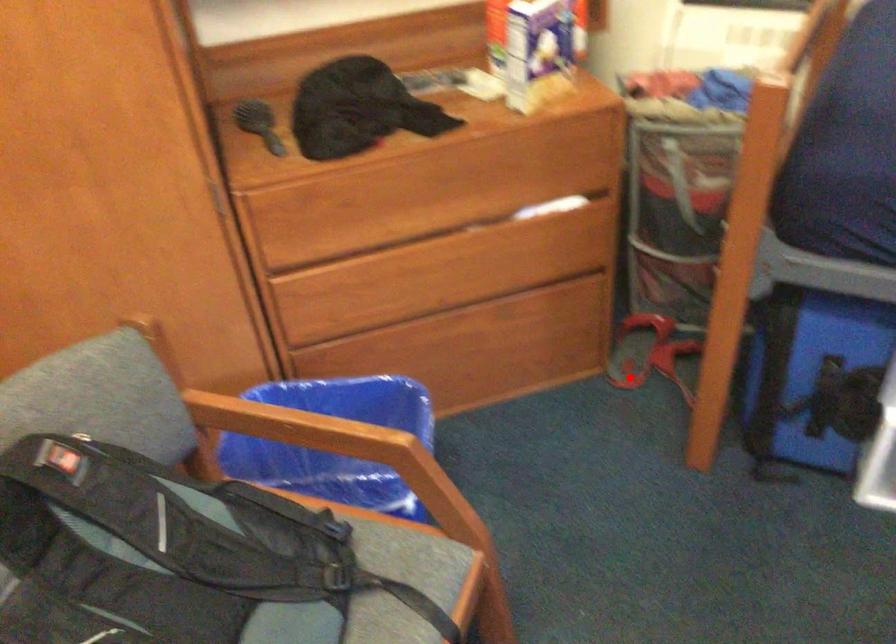
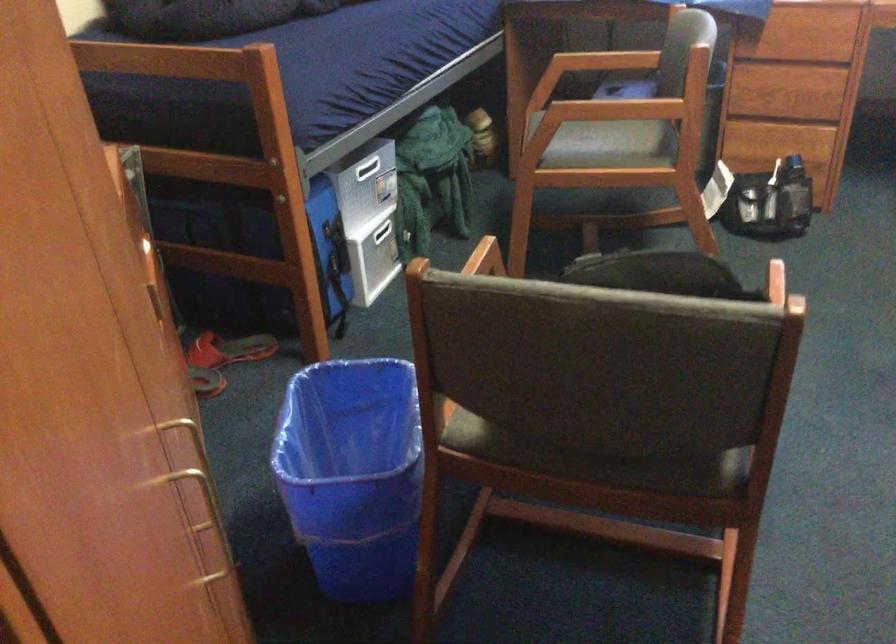
Question: A red point is marked in image1. In image2, is the corresponding 3D point closer to the camera or farther? Reply with the corresponding letter.

Choices:
 (A) The corresponding 3D point is closer.
 (B) The corresponding 3D point is farther.

Answer: (B)